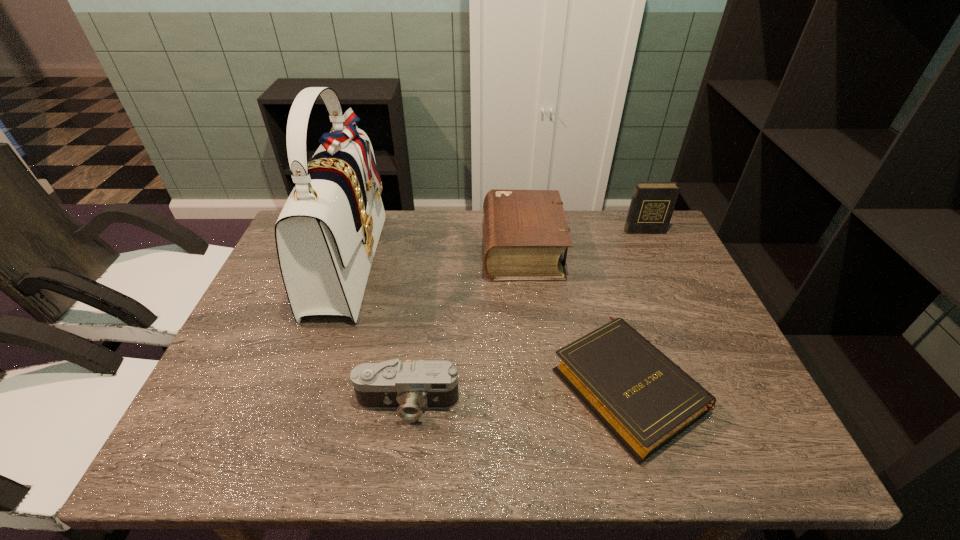
At what (x,y) coordinates should I click in order to perform the action: click on free location at the near left corner of the desktop. Please return your answer as a coordinate pair (x, y). The height and width of the screenshot is (540, 960). Looking at the image, I should click on (187, 428).

Where is `free spot between the tallest object and the farther Bible`? Image resolution: width=960 pixels, height=540 pixels. free spot between the tallest object and the farther Bible is located at coordinates (436, 255).

This screenshot has height=540, width=960. Identify the location of free area in between the nearer Bible and the diary. (636, 308).

Find the location of a particular element. This screenshot has height=540, width=960. vacant space in between the nearer Bible and the fourth object from right to left is located at coordinates (517, 395).

Where is `unoccupied area between the taller Bible and the tallest object`? The width and height of the screenshot is (960, 540). unoccupied area between the taller Bible and the tallest object is located at coordinates (436, 255).

Locate an element on the screen. Image resolution: width=960 pixels, height=540 pixels. blank region between the third tallest object and the second shortest object is located at coordinates (465, 326).

At what (x,y) coordinates should I click in order to perform the action: click on empty space that is in between the shorter Bible and the diary. Please return your answer as a coordinate pair (x, y). Looking at the image, I should click on (636, 308).

Where is `empty space between the second object from left to right and the leftmost object`? This screenshot has height=540, width=960. empty space between the second object from left to right and the leftmost object is located at coordinates 378,332.

Where is `vacant area between the third tallest object and the nearer Bible`? This screenshot has width=960, height=540. vacant area between the third tallest object and the nearer Bible is located at coordinates (574, 318).

Locate an element on the screen. This screenshot has height=540, width=960. free space between the nearer Bible and the third tallest object is located at coordinates (574, 318).